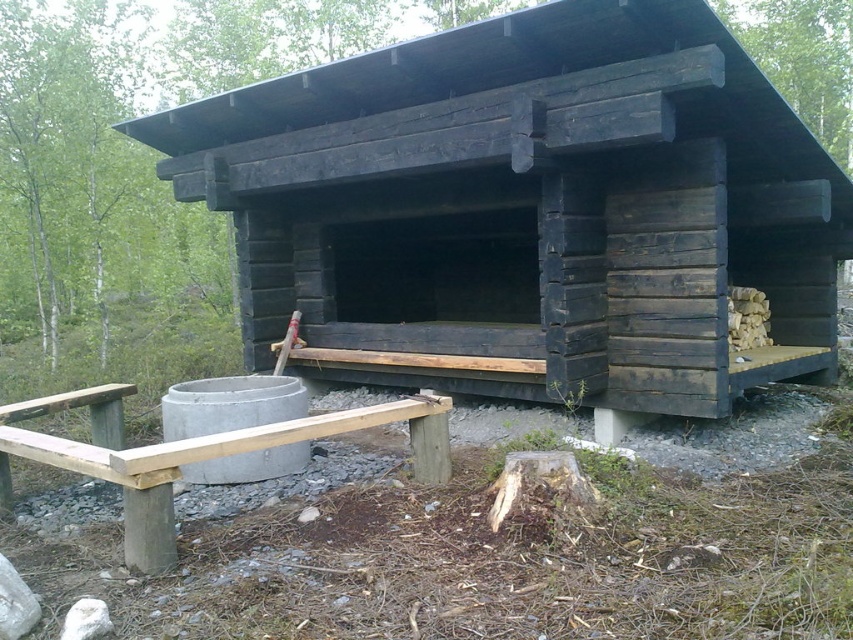
You are standing at the entrance of the black wood hut at center. If you walk straight ahead, will you immediately encounter the concrete basin or the trees?

The concrete basin is in front of the black wood hut at center, so walking straight ahead from the entrance would first lead you to the concrete basin before reaching the trees.

You are planning to set up a tent in this area and need to choose between two spots. One spot is near the black wood hut at center, and the other is near the wooden picnic table at lower left. Considering the elevation, which location would be higher?

The black wood hut at center is located above the wooden picnic table at lower left, so the spot near the black wood hut at center would be higher in elevation.

You are planning to set up a tent for an overnight stay. You have a tent that requires a space of 3 meters in width. You see the black wood hut at center and the wooden picnic table at lower left. Which object can you use to determine if the required space is available?

The black wood hut at center might be wider than wooden picnic table at lower left. Since the tent requires 3 meters in width, you should measure the width of the black wood hut at center to determine if it meets the required space.